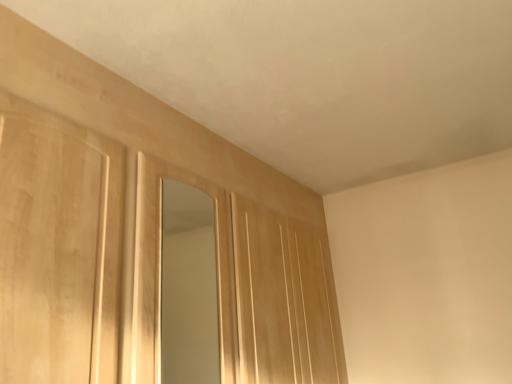
At what (x,y) coordinates should I click in order to perform the action: click on light wood paneling at center. Please return your answer as a coordinate pair (x, y). The height and width of the screenshot is (384, 512). Looking at the image, I should click on (281, 300).

The height and width of the screenshot is (384, 512). Describe the element at coordinates (281, 300) in the screenshot. I see `light wood paneling at center` at that location.

This screenshot has width=512, height=384. What do you see at coordinates (188, 287) in the screenshot? I see `light wood mirror at center` at bounding box center [188, 287].

Image resolution: width=512 pixels, height=384 pixels. Find the location of `light wood mirror at center`. light wood mirror at center is located at coordinates (188, 287).

Identify the location of light wood paneling at center. This screenshot has height=384, width=512. (281, 300).

Considering the positions of objects light wood paneling at center and light wood mirror at center in the image provided, who is more to the right, light wood paneling at center or light wood mirror at center?

Positioned to the right is light wood paneling at center.

Between light wood paneling at center and light wood mirror at center, which one is positioned in front?

Positioned in front is light wood mirror at center.

Between point (268, 374) and point (201, 288), which one is positioned behind?

Point (201, 288)

From the image's perspective, is light wood paneling at center above or below light wood mirror at center?

Based on their image positions, light wood paneling at center is located beneath light wood mirror at center.

Based on the photo, from a real-world perspective, is light wood paneling at center positioned above or below light wood mirror at center?

From a real-world perspective, light wood paneling at center is physically below light wood mirror at center.

Which of these two, light wood paneling at center or light wood mirror at center, is wider?

With larger width is light wood paneling at center.

Which of these two, light wood paneling at center or light wood mirror at center, stands taller?

light wood paneling at center.

Is light wood paneling at center bigger than light wood mirror at center?

Yes.

Could light wood mirror at center be considered to be inside light wood paneling at center?

Definitely not — light wood mirror at center is not inside light wood paneling at center.

Does light wood paneling at center touch light wood mirror at center?

No, light wood paneling at center is not next to light wood mirror at center.

Is light wood paneling at center facing towards light wood mirror at center?

No, light wood paneling at center is not facing towards light wood mirror at center.

Identify the location of mirror above the light wood paneling at center (from a real-world perspective). point(188,287).

Considering the relative positions of light wood mirror at center and light wood paneling at center in the image provided, is light wood mirror at center to the left of light wood paneling at center from the viewer's perspective?

Indeed, light wood mirror at center is positioned on the left side of light wood paneling at center.

Is light wood mirror at center in front of light wood paneling at center?

Yes, light wood mirror at center is closer to the viewer.

Is point (215, 348) farther from viewer compared to point (321, 259)?

That is True.

From the image's perspective, is light wood mirror at center located above or below light wood paneling at center?

Clearly, from the image's perspective, light wood mirror at center is above light wood paneling at center.

From a real-world perspective, which is physically above, light wood mirror at center or light wood paneling at center?

From a 3D spatial view, light wood mirror at center is above.

Looking at their sizes, would you say light wood mirror at center is wider or thinner than light wood paneling at center?

light wood mirror at center is thinner than light wood paneling at center.

Considering the relative sizes of light wood mirror at center and light wood paneling at center in the image provided, is light wood mirror at center taller than light wood paneling at center?

Incorrect, the height of light wood mirror at center is not larger of that of light wood paneling at center.

Can you confirm if light wood mirror at center is bigger than light wood paneling at center?

Incorrect, light wood mirror at center is not larger than light wood paneling at center.

Is light wood mirror at center completely or partially outside of light wood paneling at center?

Yes, light wood mirror at center is outside of light wood paneling at center.

Is the surface of light wood mirror at center in direct contact with light wood paneling at center?

There is a gap between light wood mirror at center and light wood paneling at center.

Could you tell me if light wood mirror at center is facing light wood paneling at center?

No.

Identify the location of door below the light wood mirror at center (from the image's perspective). (281, 300).

Identify the location of mirror lying above the light wood paneling at center (from the image's perspective). click(188, 287).

In order to click on door located below the light wood mirror at center (from the image's perspective) in this screenshot , I will do `click(281, 300)`.